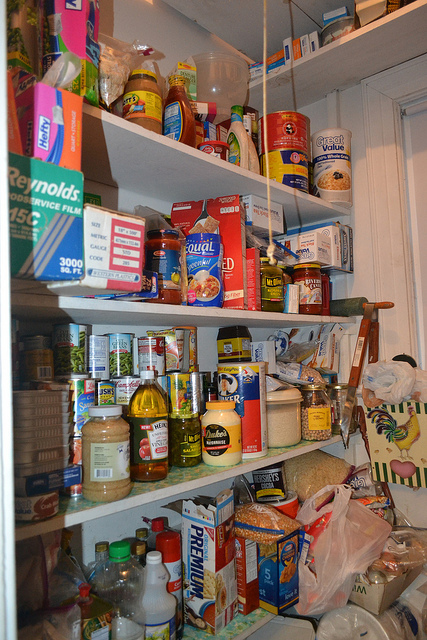
Where is `bottle`? bottle is located at coordinates (154, 585).